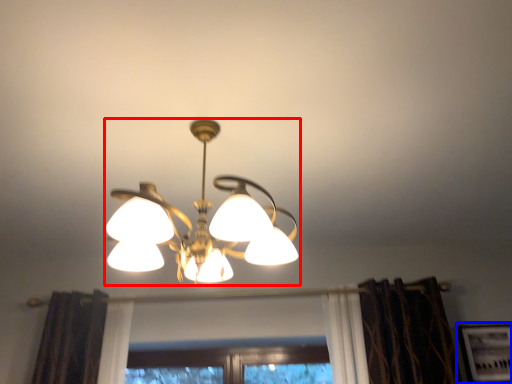
Question: Which of the following is the closest to the observer, lamp (highlighted by a red box) or picture frame (highlighted by a blue box)?

Choices:
 (A) lamp
 (B) picture frame

Answer: (A)